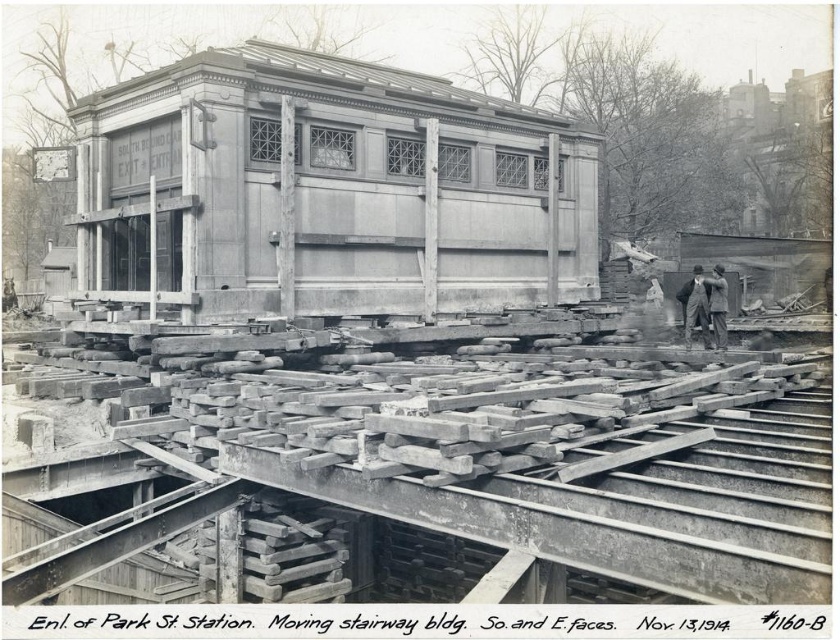
Question: Can you confirm if wooden structure at center is bigger than dark gray wool coat at center?

Choices:
 (A) yes
 (B) no

Answer: (A)

Question: Can you confirm if wooden structure at center is positioned above dark gray wool coat at center?

Choices:
 (A) yes
 (B) no

Answer: (A)

Question: Can you confirm if wooden structure at center is positioned to the left of dark gray suit at center?

Choices:
 (A) yes
 (B) no

Answer: (A)

Question: Which object is farther from the camera taking this photo?

Choices:
 (A) wooden structure at center
 (B) dark gray wool coat at center

Answer: (B)

Question: Which object is the closest to the dark gray suit at center?

Choices:
 (A) dark gray wool coat at center
 (B) wooden structure at center
 (C) wooden planks at center

Answer: (A)

Question: Which of these objects is positioned closest to the dark gray suit at center?

Choices:
 (A) wooden structure at center
 (B) dark gray wool coat at center
 (C) wooden planks at center

Answer: (B)